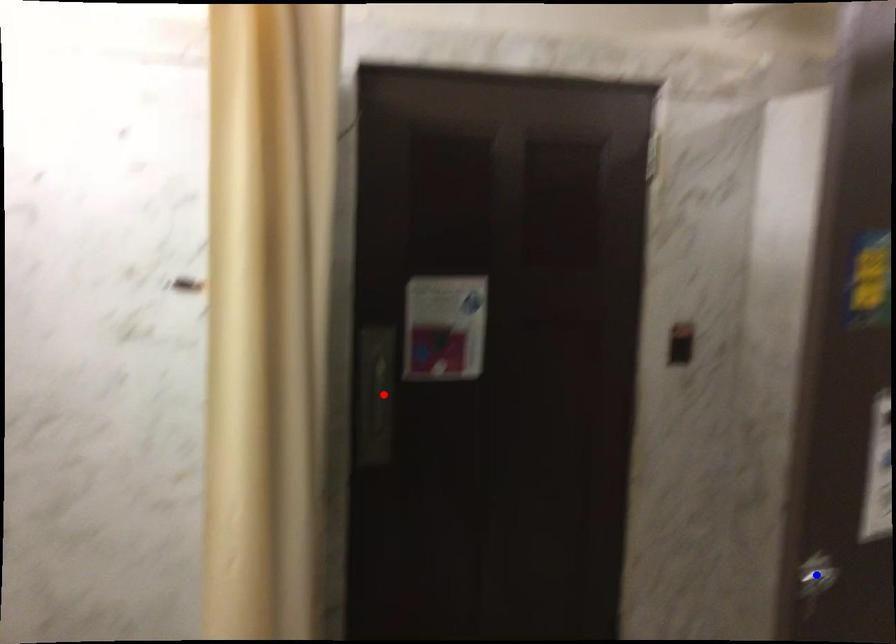
Question: Which of the two points in the image is closer to the camera?

Choices:
 (A) Blue point is closer.
 (B) Red point is closer.

Answer: (A)